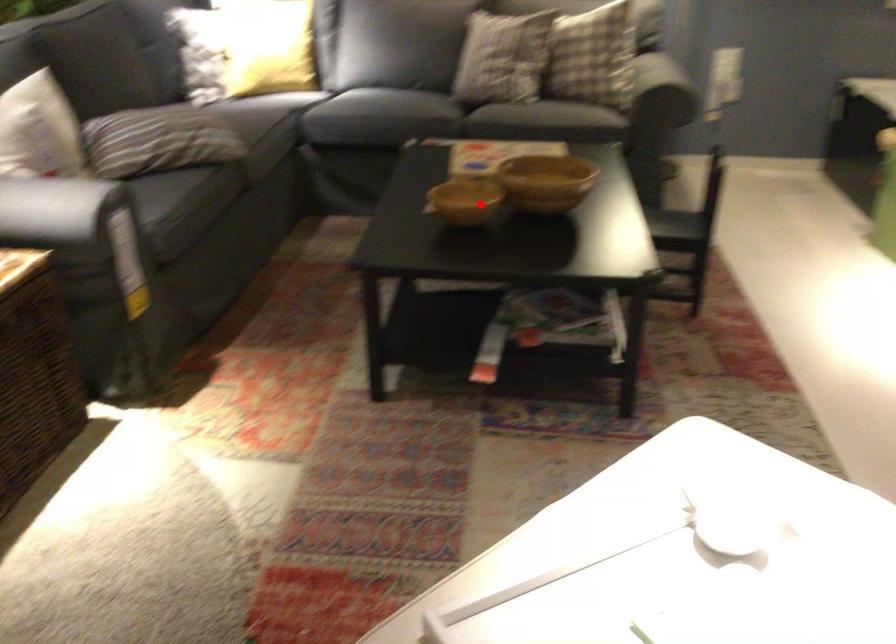
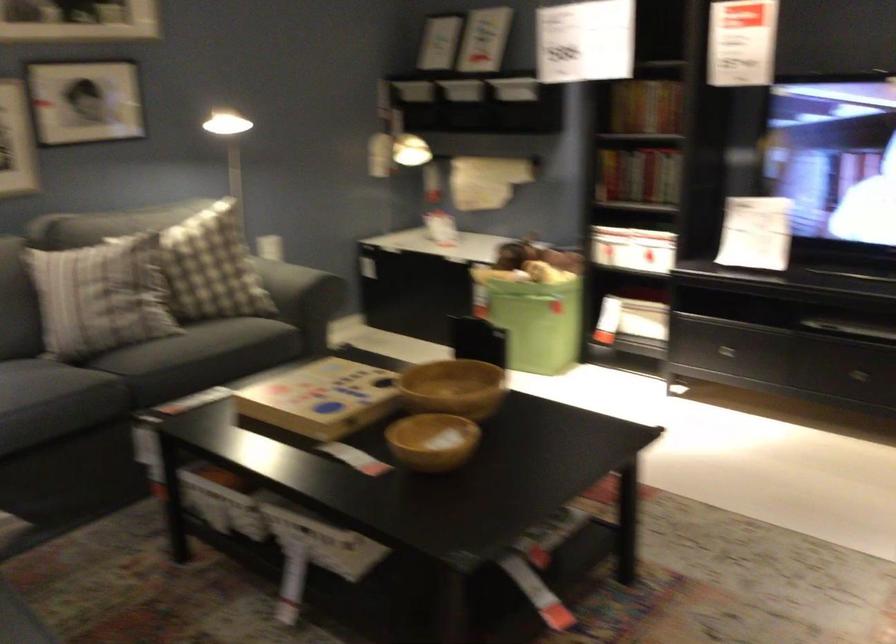
Find the pixel in the second image that matches the highlighted location in the first image.

(433, 440)